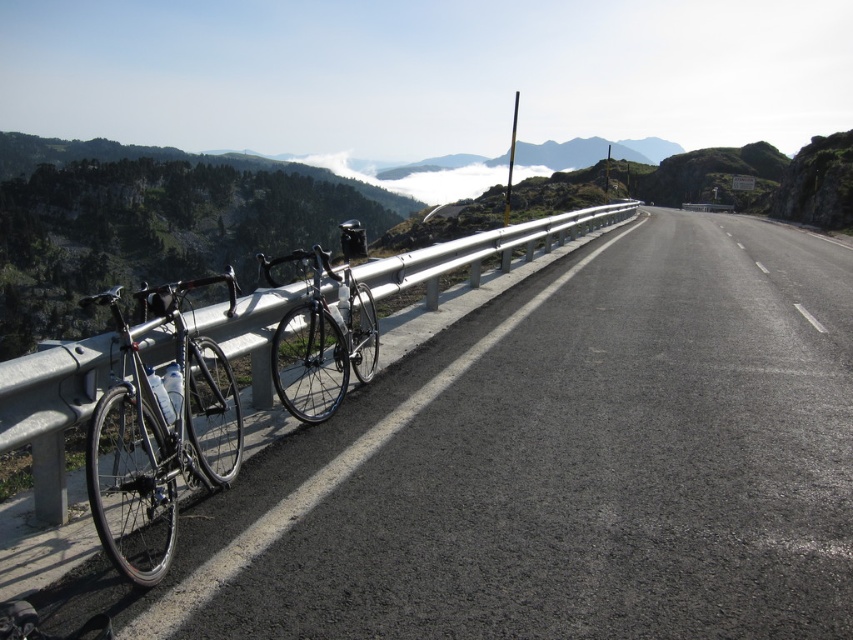
Who is lower down, silver metallic rail at left or shiny black bicycle at center?

silver metallic rail at left is below.

Is silver metallic rail at left wider than shiny black bicycle at center?

No.

Between point (238, 314) and point (357, 317), which one is positioned in front?

Positioned in front is point (238, 314).

This screenshot has height=640, width=853. I want to click on silver metallic rail at left, so click(x=50, y=406).

Who is positioned more to the left, shiny silver bicycle at left or shiny black bicycle at center?

From the viewer's perspective, shiny silver bicycle at left appears more on the left side.

Measure the distance between point (106,435) and camera.

Point (106,435) and camera are 5.37 meters apart from each other.

The image size is (853, 640). I want to click on shiny silver bicycle at left, so click(160, 433).

Which of these two, shiny silver bicycle at left or silver metallic rail at left, stands taller?

silver metallic rail at left

Can you confirm if shiny silver bicycle at left is positioned to the left of silver metallic rail at left?

Yes, shiny silver bicycle at left is to the left of silver metallic rail at left.

Is point (231, 410) positioned behind point (53, 400)?

Yes, it is behind point (53, 400).

You are a GUI agent. You are given a task and a screenshot of the screen. Output one action in this format:
    pyautogui.click(x=<x>, y=<y>)
    Task: Click on the shiny silver bicycle at left
    
    Given the screenshot: What is the action you would take?
    pyautogui.click(x=160, y=433)